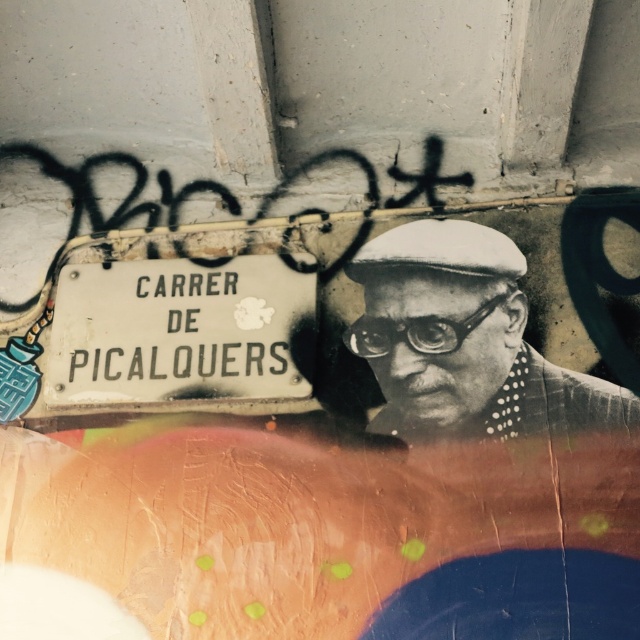
Question: Observing the image, what is the correct spatial positioning of black textured hat at center in reference to white matte street sign at center?

Choices:
 (A) right
 (B) left

Answer: (A)

Question: Can you confirm if black textured hat at center is thinner than white matte street sign at center?

Choices:
 (A) no
 (B) yes

Answer: (A)

Question: Can you confirm if black textured hat at center is positioned above white matte street sign at center?

Choices:
 (A) no
 (B) yes

Answer: (A)

Question: Which object is closer to the camera taking this photo?

Choices:
 (A) black textured hat at center
 (B) white matte street sign at center

Answer: (A)

Question: Which of the following is the farthest from the observer?

Choices:
 (A) white matte street sign at center
 (B) black textured hat at center

Answer: (A)